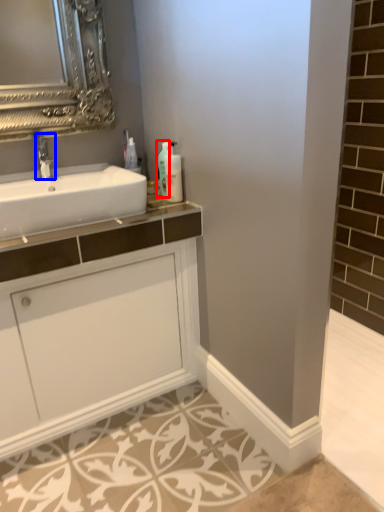
Question: Which object is closer to the camera taking this photo, soap dispenser (highlighted by a red box) or tap (highlighted by a blue box)?

Choices:
 (A) soap dispenser
 (B) tap

Answer: (B)